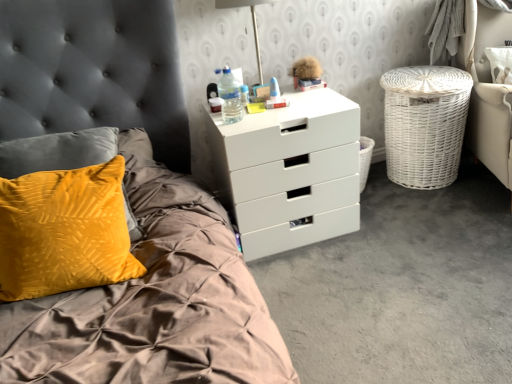
This screenshot has height=384, width=512. Find the location of `spots to the right of white plastic chest of drawers at upper center`. spots to the right of white plastic chest of drawers at upper center is located at coordinates (399, 220).